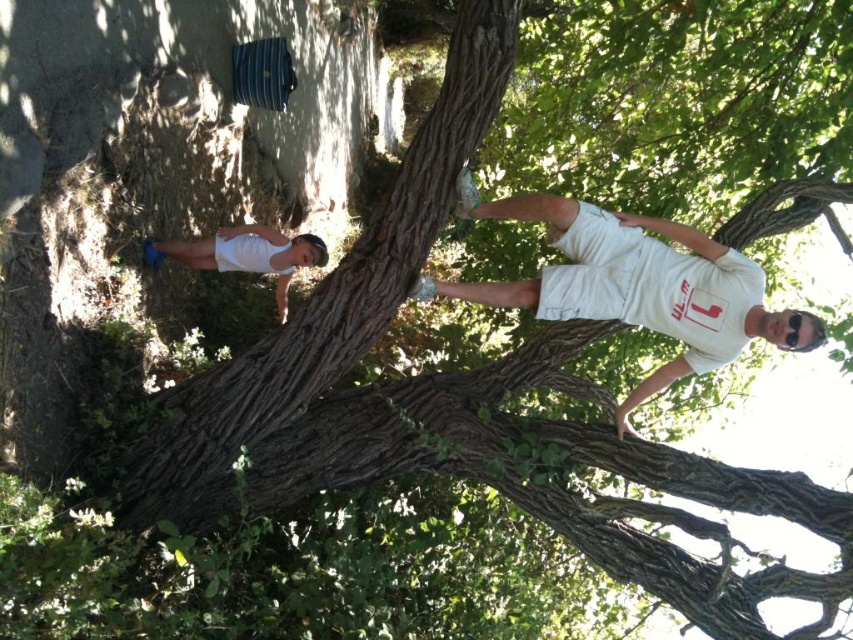
Question: Does white cotton shirt at upper right have a smaller size compared to white matte shorts at lower left?

Choices:
 (A) no
 (B) yes

Answer: (A)

Question: Which of the following is the closest to the observer?

Choices:
 (A) (703, 328)
 (B) (236, 259)

Answer: (A)

Question: Among these points, which one is farthest from the camera?

Choices:
 (A) (598, 317)
 (B) (289, 250)

Answer: (B)

Question: Among these points, which one is nearest to the camera?

Choices:
 (A) (573, 248)
 (B) (224, 227)

Answer: (A)

Question: Observing the image, what is the correct spatial positioning of white cotton shirt at upper right in reference to white matte shorts at lower left?

Choices:
 (A) above
 (B) below

Answer: (B)

Question: Is white cotton shirt at upper right positioned behind white matte shorts at lower left?

Choices:
 (A) no
 (B) yes

Answer: (A)